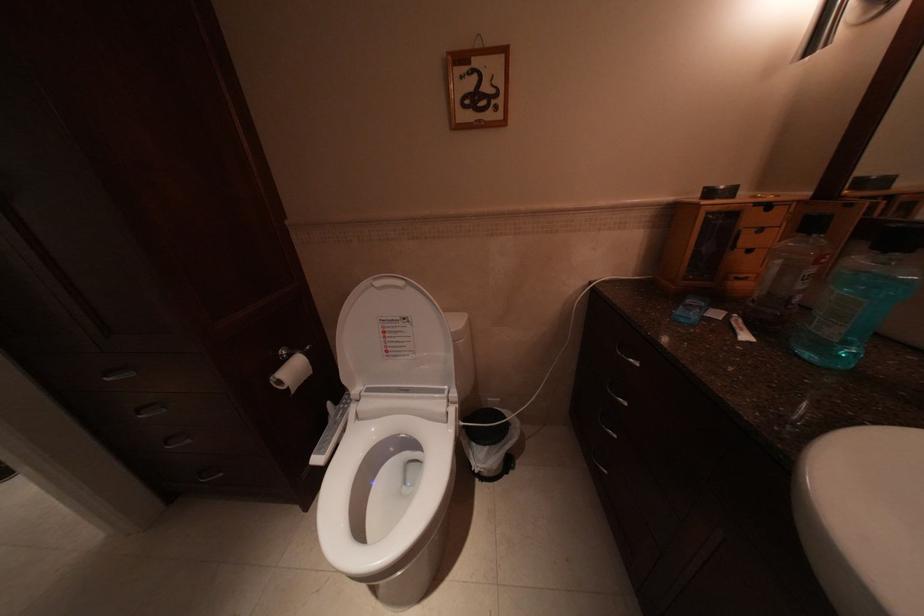
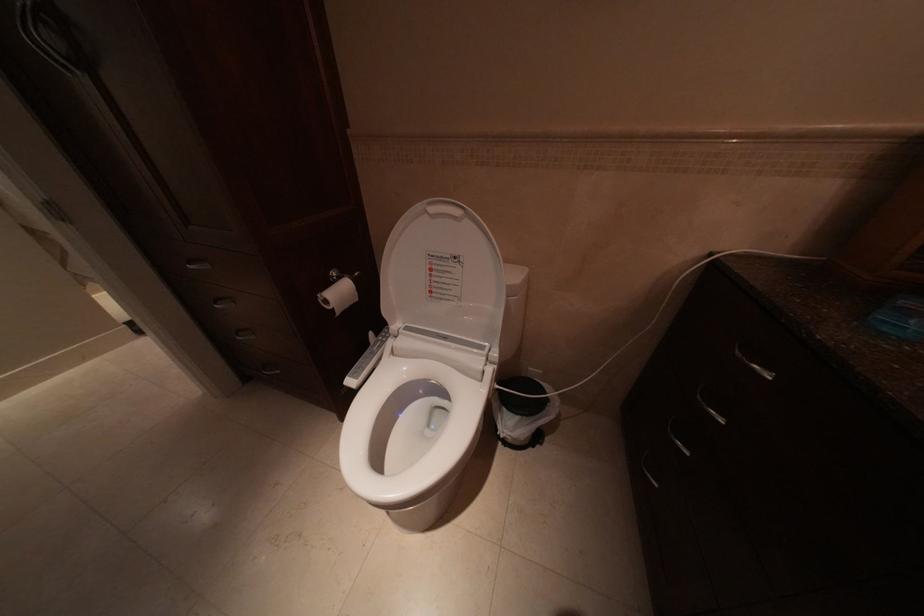
Question: The camera is either moving clockwise (left) or counter-clockwise (right) around the object. The first image is from the beginning of the video and the second image is from the end. Is the camera moving left or right when shooting the video?

Choices:
 (A) Left
 (B) Right

Answer: (B)